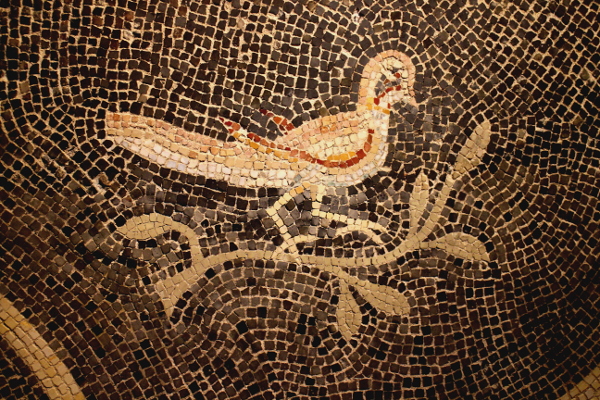
Identify the location of red tile. Image resolution: width=600 pixels, height=400 pixels. (352, 162).